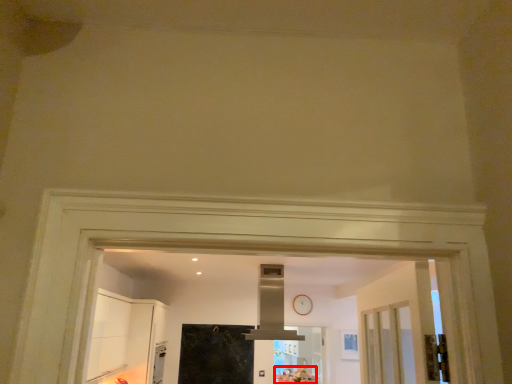
Question: Observing the image, what is the correct spatial positioning of flower (annotated by the red box) in reference to exhaust hood?

Choices:
 (A) right
 (B) left

Answer: (A)